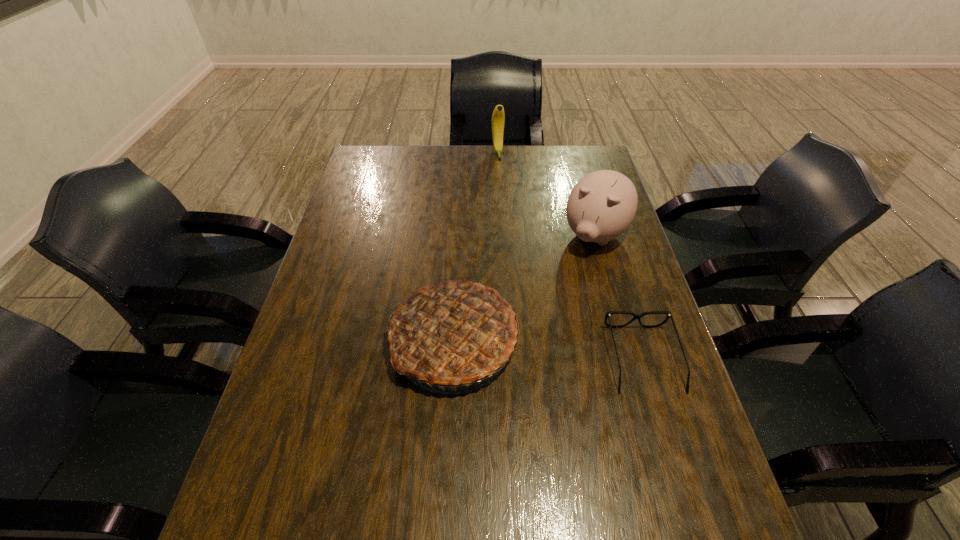
Find the location of a particular element. The height and width of the screenshot is (540, 960). vacant space located 0.400m at the snout of the piggy bank is located at coordinates 522,359.

This screenshot has width=960, height=540. In order to click on vacant area situated at the snout of the piggy bank in this screenshot , I will do `click(537, 335)`.

The height and width of the screenshot is (540, 960). Identify the location of object at the far edge. (498, 117).

Where is `spectacles located in the right edge section of the desktop`? The width and height of the screenshot is (960, 540). spectacles located in the right edge section of the desktop is located at coordinates (636, 316).

The image size is (960, 540). What are the coordinates of `piggy bank present at the right edge` in the screenshot? It's located at (602, 205).

Locate an element on the screen. This screenshot has width=960, height=540. free spot at the far edge of the desktop is located at coordinates (536, 176).

Locate an element on the screen. vacant space at the near edge of the desktop is located at coordinates (415, 468).

The image size is (960, 540). I want to click on vacant space at the left edge of the desktop, so (340, 296).

Image resolution: width=960 pixels, height=540 pixels. In order to click on free space at the right edge of the desktop in this screenshot , I will do `click(598, 272)`.

Find the location of a particular element. The width and height of the screenshot is (960, 540). free space at the far right corner of the desktop is located at coordinates (567, 156).